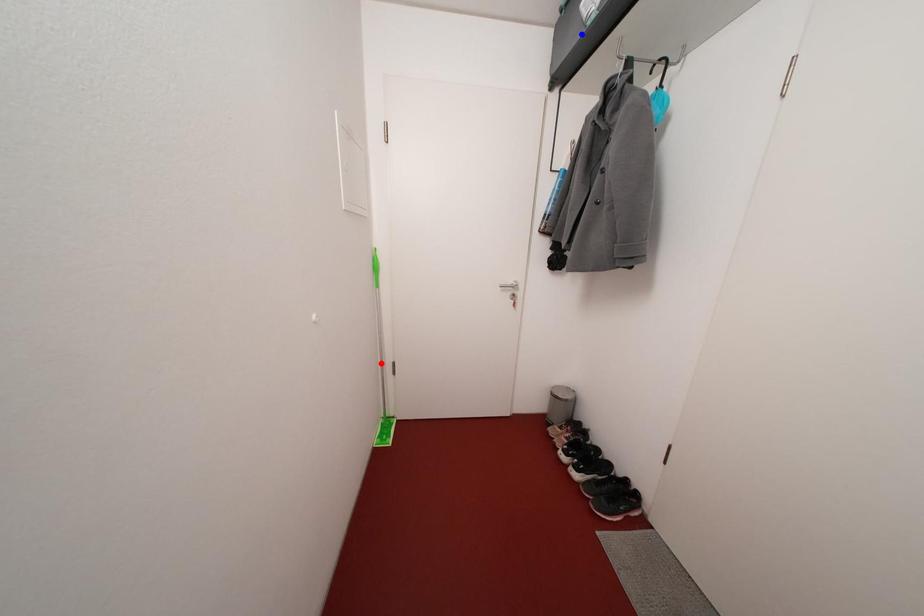
Question: Which of the two points in the image is closer to the camera?

Choices:
 (A) Blue point is closer.
 (B) Red point is closer.

Answer: (A)